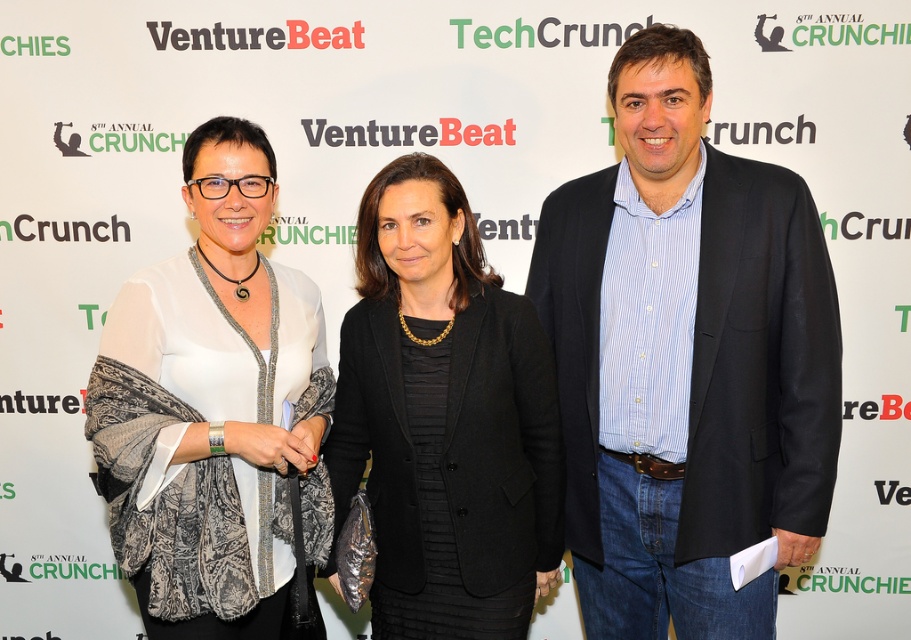
Based on the photo, which of these two, blue striped shirt at center or black textured blazer at center, stands taller?

blue striped shirt at center

Can you confirm if blue striped shirt at center is positioned above black textured blazer at center?

Correct, blue striped shirt at center is located above black textured blazer at center.

Locate an element on the screen. blue striped shirt at center is located at coordinates (686, 360).

Is white sheer blouse at center positioned in front of black textured blazer at center?

Yes, white sheer blouse at center is in front of black textured blazer at center.

The height and width of the screenshot is (640, 911). Describe the element at coordinates (213, 408) in the screenshot. I see `white sheer blouse at center` at that location.

What are the coordinates of `white sheer blouse at center` in the screenshot? It's located at (213, 408).

Is point (635, 554) positioned after point (241, 300)?

Yes, it is.

Find the location of a particular element. This screenshot has width=911, height=640. blue striped shirt at center is located at coordinates (686, 360).